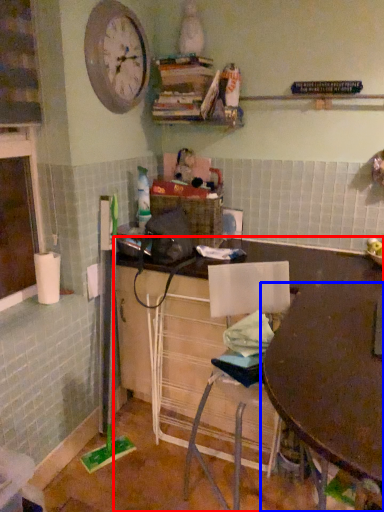
Question: Among these objects, which one is nearest to the camera, desk (highlighted by a red box) or table (highlighted by a blue box)?

Choices:
 (A) desk
 (B) table

Answer: (B)